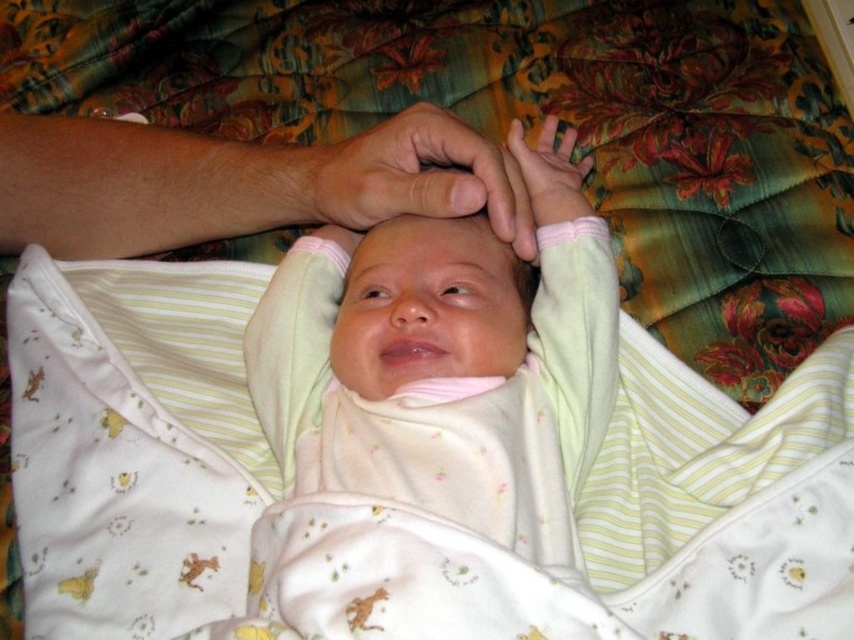
Question: Which point is closer to the camera?

Choices:
 (A) (98, 237)
 (B) (383, 164)

Answer: (B)

Question: Which object appears closest to the camera in this image?

Choices:
 (A) soft yellow fabric swaddle at center
 (B) smooth skin hand at center
 (C) pink fabric at center

Answer: (A)

Question: Is soft yellow fabric swaddle at center positioned in front of pink fabric at center?

Choices:
 (A) yes
 (B) no

Answer: (A)

Question: Among these points, which one is farthest from the camera?

Choices:
 (A) (144, 246)
 (B) (319, 150)

Answer: (A)

Question: Is soft yellow fabric swaddle at center to the right of pink fabric at center from the viewer's perspective?

Choices:
 (A) no
 (B) yes

Answer: (A)

Question: Observing the image, what is the correct spatial positioning of smooth skin hand at upper center in reference to smooth skin hand at center?

Choices:
 (A) above
 (B) below

Answer: (B)